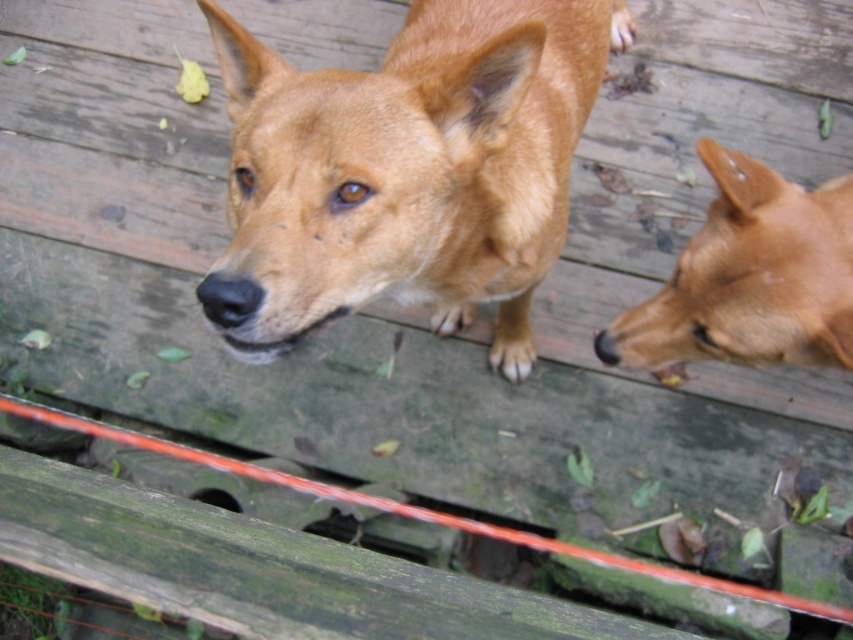
Question: Which point is closer to the camera taking this photo?

Choices:
 (A) (401, 33)
 (B) (624, 321)

Answer: (B)

Question: Which object is closer to the camera taking this photo?

Choices:
 (A) brown furry dog at upper center
 (B) brown furry dog at right

Answer: (A)

Question: Does brown furry dog at upper center come behind brown furry dog at right?

Choices:
 (A) yes
 (B) no

Answer: (B)

Question: Is brown furry dog at upper center further to the viewer compared to brown furry dog at right?

Choices:
 (A) no
 (B) yes

Answer: (A)

Question: Is brown furry dog at upper center smaller than brown furry dog at right?

Choices:
 (A) no
 (B) yes

Answer: (A)